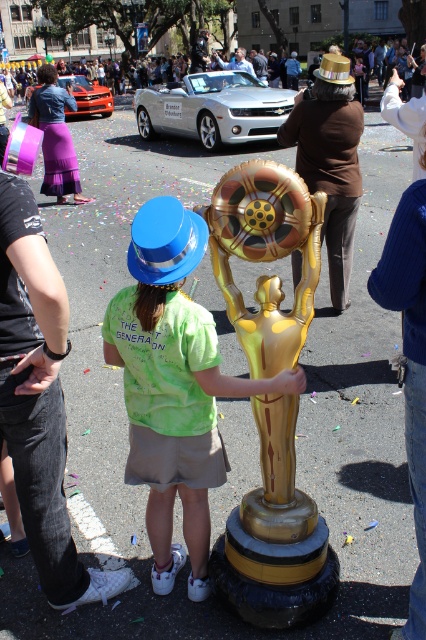
Question: Observing the image, what is the correct spatial positioning of gold metallic statue at center in reference to green tie-dye shirt at center?

Choices:
 (A) left
 (B) right

Answer: (B)

Question: Is gold metallic statue at center thinner than green tie-dye shirt at center?

Choices:
 (A) yes
 (B) no

Answer: (A)

Question: Is gold metallic statue at center to the right of green tie-dye shirt at center from the viewer's perspective?

Choices:
 (A) no
 (B) yes

Answer: (B)

Question: Which of the following is the closest to the observer?

Choices:
 (A) green tie-dye shirt at center
 (B) gold metallic statue at center

Answer: (A)